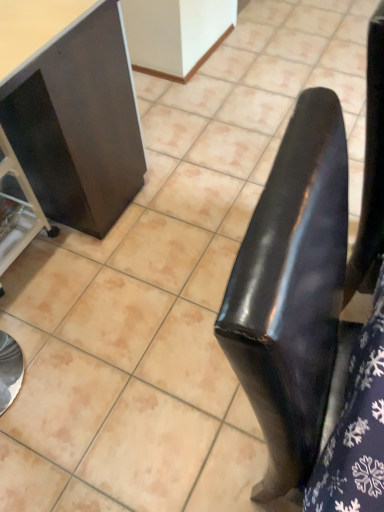
Image resolution: width=384 pixels, height=512 pixels. Find the location of `vacant area that is in front of matte black cabinet at left, placed as the 2th furniture when sorted from left to right`. vacant area that is in front of matte black cabinet at left, placed as the 2th furniture when sorted from left to right is located at coordinates (97, 392).